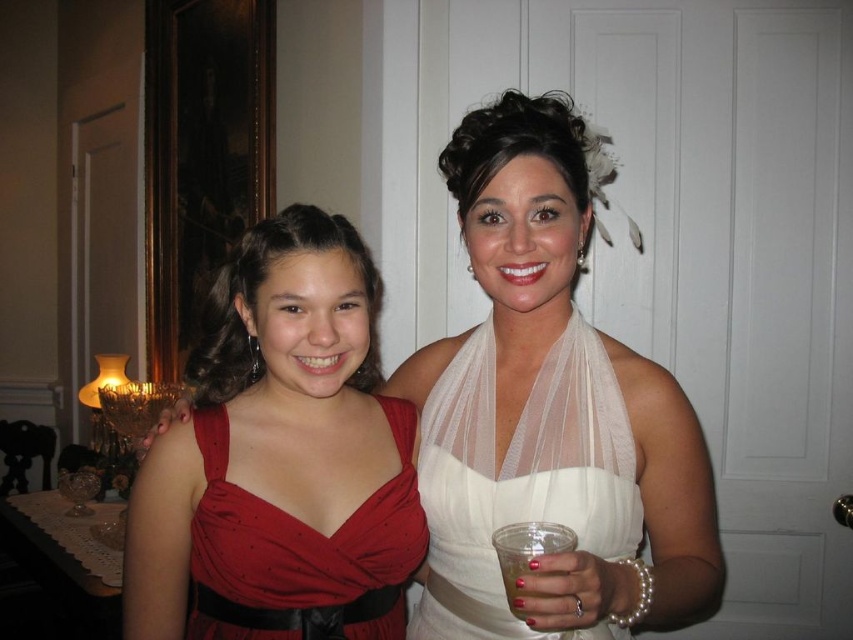
Question: Which point is closer to the camera?

Choices:
 (A) white sheer veil at center
 (B) white sheer dress at center
 (C) clear plastic cup at lower center
 (D) matte red dress at left

Answer: (B)

Question: Which object is positioned farthest from the clear plastic cup at lower center?

Choices:
 (A) white sheer dress at center
 (B) shiny satin dress at center
 (C) white sheer veil at center

Answer: (B)

Question: Can you confirm if matte red dress at left is bigger than white sheer veil at center?

Choices:
 (A) no
 (B) yes

Answer: (B)

Question: From the image, what is the correct spatial relationship of white sheer dress at center in relation to clear plastic cup at lower center?

Choices:
 (A) right
 (B) left

Answer: (A)

Question: Which point is closer to the camera?

Choices:
 (A) clear plastic cup at lower center
 (B) white sheer dress at center

Answer: (B)

Question: Does white sheer dress at center appear on the right side of shiny satin dress at center?

Choices:
 (A) no
 (B) yes

Answer: (B)